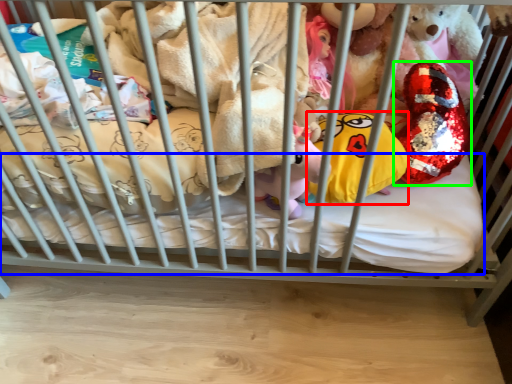
Question: Which is farther away from pillow (highlighted by a red box)? mattress (highlighted by a blue box) or toy (highlighted by a green box)?

Choices:
 (A) mattress
 (B) toy

Answer: (A)